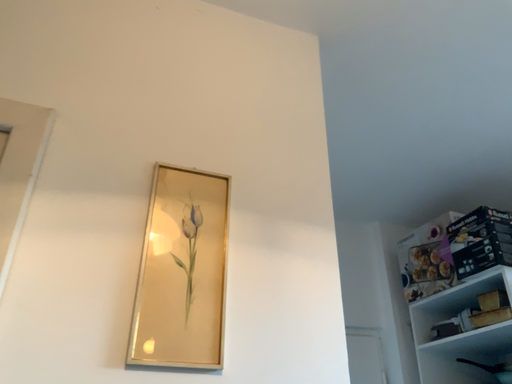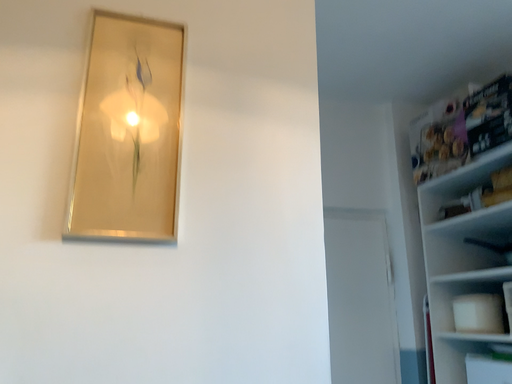
Question: How did the camera likely rotate when shooting the video?

Choices:
 (A) rotated downward
 (B) rotated upward

Answer: (A)